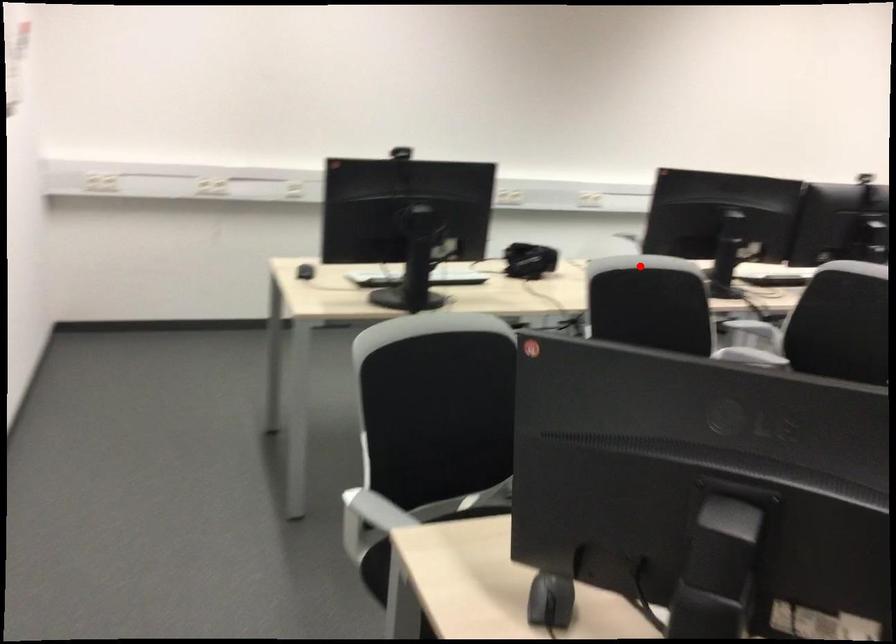
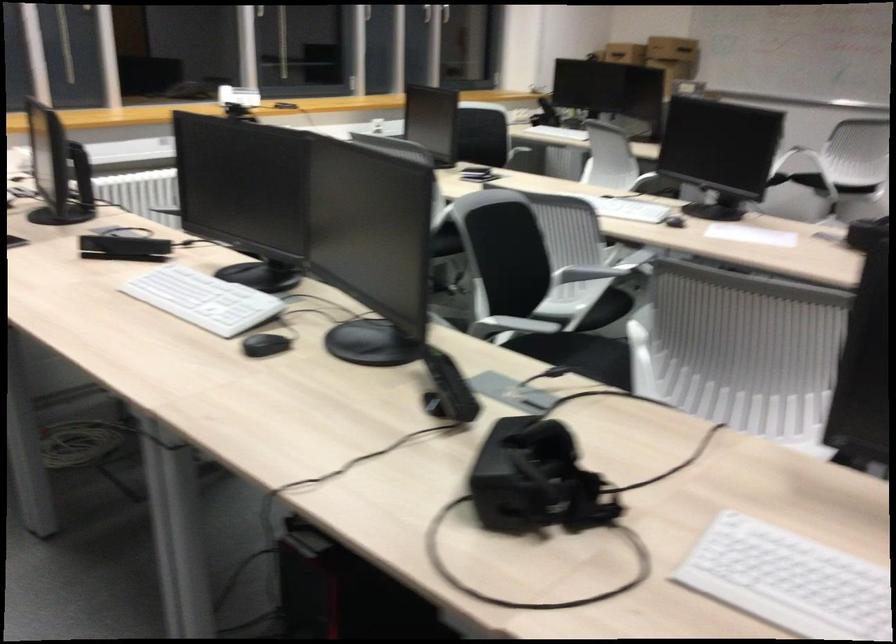
Question: A red point is marked in image1. In image2, is the corresponding 3D point closer to the camera or farther? Reply with the corresponding letter.

Choices:
 (A) The corresponding 3D point is closer.
 (B) The corresponding 3D point is farther.

Answer: (A)